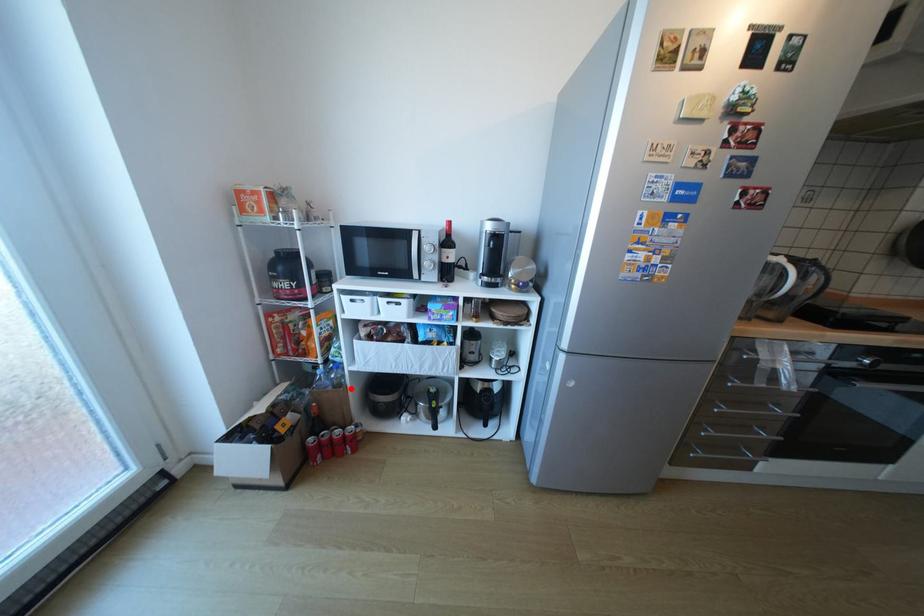
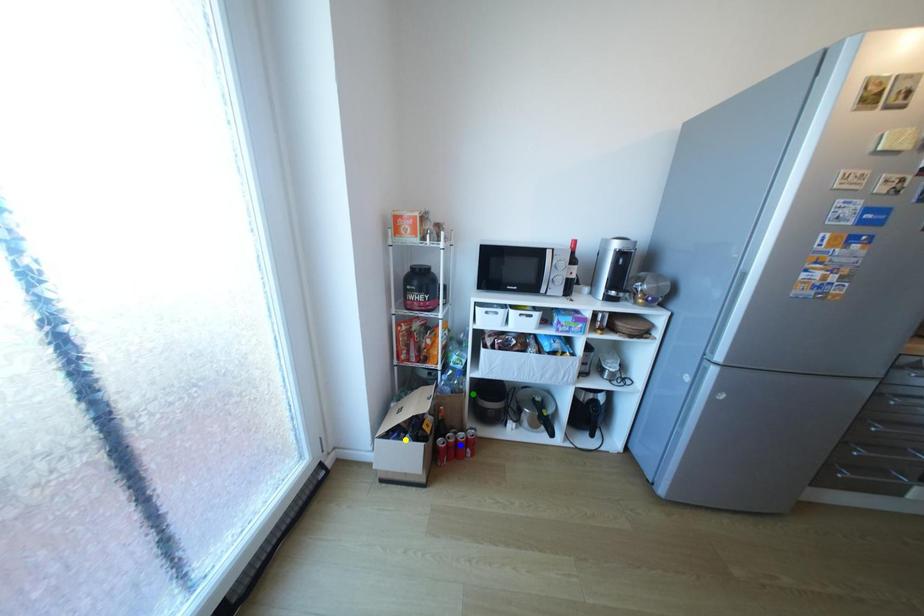
Question: I am providing you with two images of the same scene from different viewpoints. A red point is marked on the first image. You are given multiple points on the second image. Can you choose the point in image 2 that corresponds to the point in image 1?

Choices:
 (A) yellow point
 (B) blue point
 (C) green point

Answer: (C)